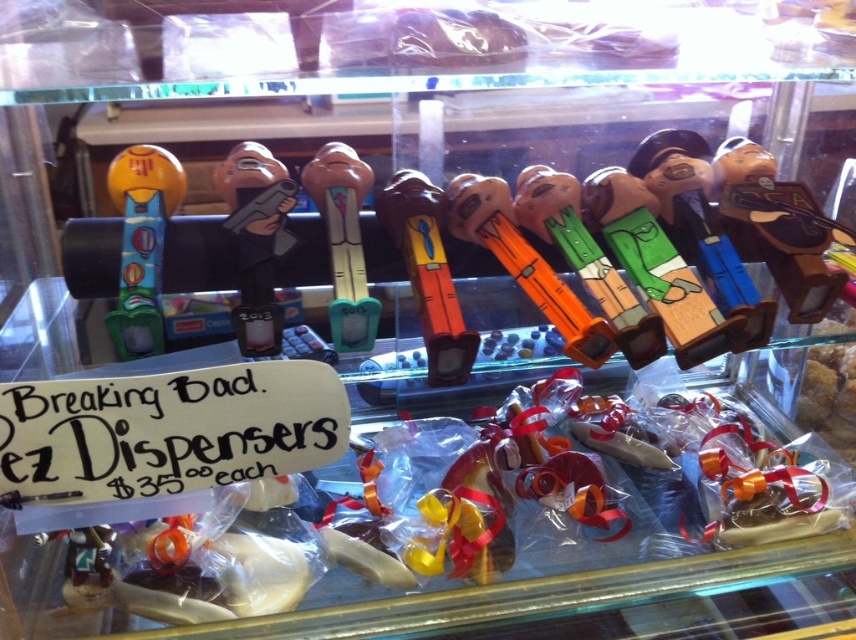
You are a museum visitor who wants to take a photo of both the white paper sign at lower left and the orange plastic toy at center in the display case. Your camera has a maximum focus range of 14 inches. Can you capture both items in a single photo without moving your position?

The distance between the white paper sign at lower left and the orange plastic toy at center is 14.16 inches. Since your camera can only focus up to 14 inches, you cannot capture both items in a single photo without moving your position.

You are standing in front of the display case and want to reach the point at coordinates [753,192]. Your arm can extend 36 inches. Can you reach that point?

The point at [753,192] is 36.66 inches away from you, which is slightly beyond your arm extension of 36 inches. You cannot reach it.